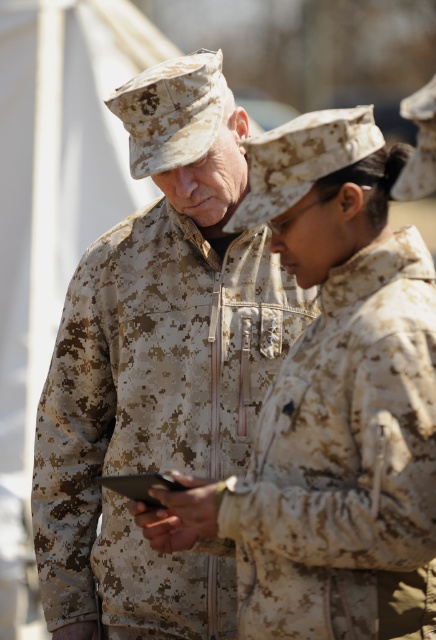
Question: Among these points, which one is nearest to the camera?

Choices:
 (A) (346, 468)
 (B) (160, 275)

Answer: (A)

Question: Can you confirm if camouflage uniform at center is smaller than camouflage fabric jacket at center?

Choices:
 (A) yes
 (B) no

Answer: (B)

Question: Which object is closer to the camera taking this photo?

Choices:
 (A) camouflage fabric jacket at center
 (B) camouflage uniform at center

Answer: (A)

Question: Can you confirm if camouflage uniform at center is positioned below camouflage fabric jacket at center?

Choices:
 (A) yes
 (B) no

Answer: (B)

Question: Does camouflage uniform at center appear on the left side of camouflage fabric jacket at center?

Choices:
 (A) yes
 (B) no

Answer: (A)